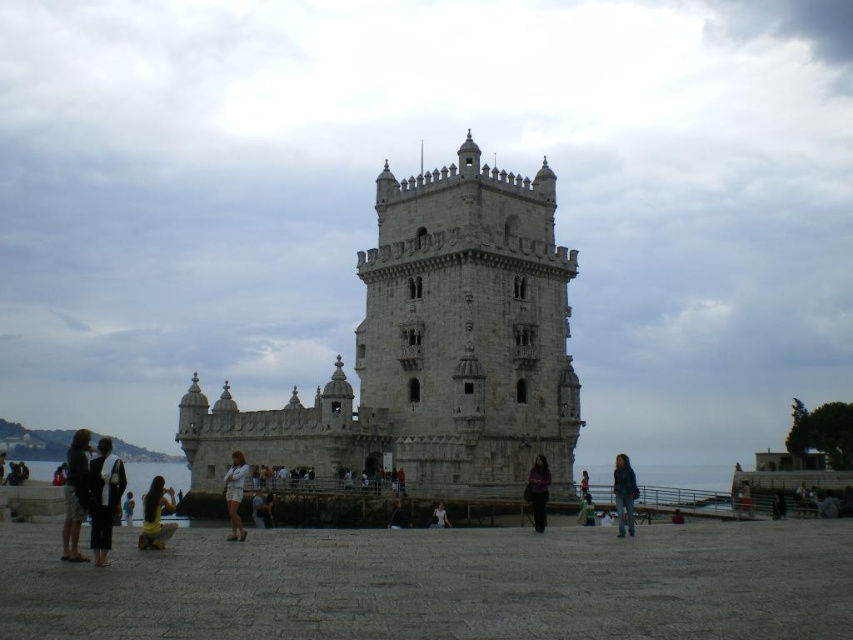
Question: Considering the relative positions of green fabric jacket at lower center and light brown leather jacket at lower right in the image provided, where is green fabric jacket at lower center located with respect to light brown leather jacket at lower right?

Choices:
 (A) below
 (B) above

Answer: (B)

Question: Which of the following is the farthest from the observer?

Choices:
 (A) dark brown leather jacket at center
 (B) dark brown leather jacket at lower left

Answer: (A)

Question: Can you confirm if stone tower at center is smaller than green fabric jacket at lower center?

Choices:
 (A) yes
 (B) no

Answer: (B)

Question: Is dark gray fabric pants at lower left positioned behind light brown leather jacket at center?

Choices:
 (A) yes
 (B) no

Answer: (B)

Question: Which is farther from the purple fabric at center?

Choices:
 (A) light brown leather jacket at lower right
 (B) dark brown leather jacket at lower left

Answer: (B)

Question: Which of the following is the closest to the observer?

Choices:
 (A) pyautogui.click(x=132, y=502)
 (B) pyautogui.click(x=74, y=524)
 (C) pyautogui.click(x=262, y=499)

Answer: (B)